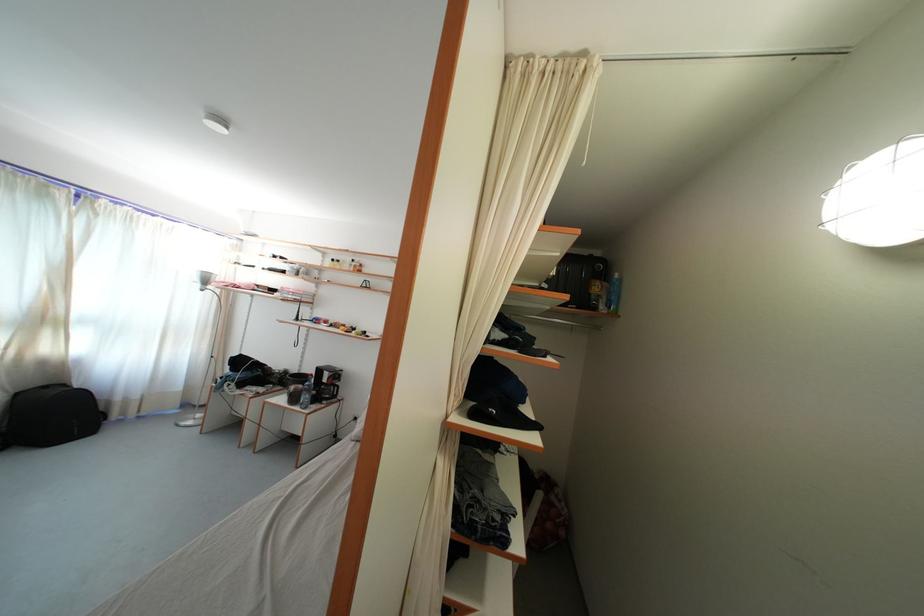
Locate an element on the screen. Image resolution: width=924 pixels, height=616 pixels. white window curtain is located at coordinates (33, 281).